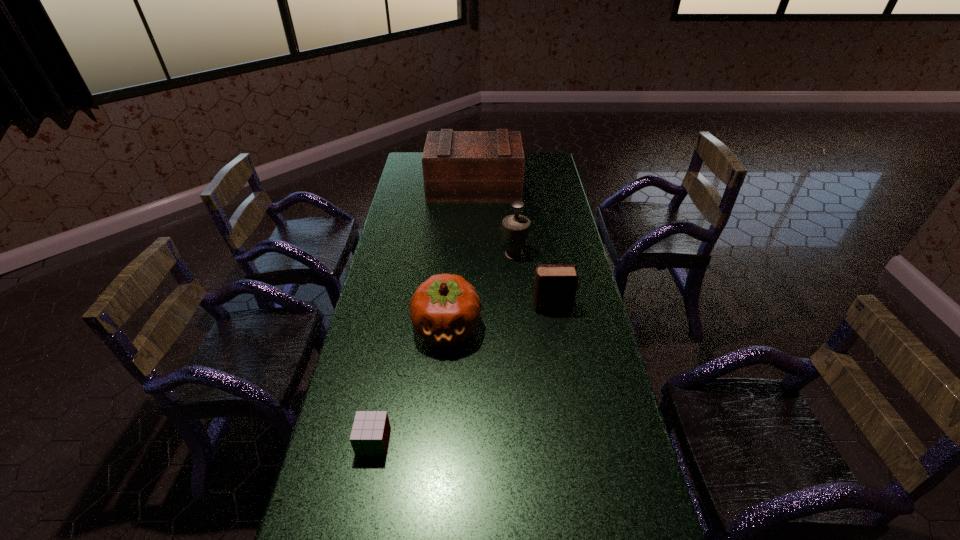
This screenshot has height=540, width=960. I want to click on box, so click(x=458, y=166).

I want to click on the fourth nearest object, so click(515, 227).

The height and width of the screenshot is (540, 960). I want to click on pumpkin, so click(x=445, y=309).

You are a GUI agent. You are given a task and a screenshot of the screen. Output one action in this format:
    pyautogui.click(x=<x>, y=<y>)
    Task: Click on the diary
    
    Given the screenshot: What is the action you would take?
    pyautogui.click(x=555, y=286)

This screenshot has width=960, height=540. In order to click on the nearest object in this screenshot , I will do `click(370, 433)`.

At what (x,y) coordinates should I click in order to perform the action: click on cube. Please return your answer as a coordinate pair (x, y). This screenshot has width=960, height=540. Looking at the image, I should click on (370, 433).

The image size is (960, 540). Find the location of `vacant space located on the left of the box`. vacant space located on the left of the box is located at coordinates (402, 187).

Locate an element on the screen. vacant region located on the front of the urn is located at coordinates (522, 341).

Image resolution: width=960 pixels, height=540 pixels. Identify the location of blank area located on the side of the pumpkin with the cute face. (443, 384).

Identify the location of free space located 0.190m on the spine side of the fourth tallest object. (477, 307).